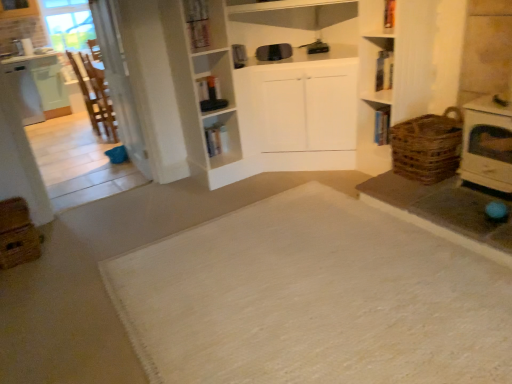
Identify the location of white woven mat at center. (313, 299).

The image size is (512, 384). I want to click on brown woven crate at lower left, so click(17, 234).

I want to click on white woven mat at center, so (x=313, y=299).

Is brown woven crate at lower left surrounded by white woven mat at center?

No, brown woven crate at lower left is not inside white woven mat at center.

Locate an element on the screen. crate located above the white woven mat at center (from the image's perspective) is located at coordinates (17, 234).

From a real-world perspective, is white woven mat at center below brown woven crate at lower left?

Correct, in the physical world, white woven mat at center is lower than brown woven crate at lower left.

Between white woven mat at center and brown woven crate at lower left, which one has less height?

white woven mat at center is shorter.

Considering the sizes of objects white woven mat at center and brown woven basket at right in the image provided, who is thinner, white woven mat at center or brown woven basket at right?

brown woven basket at right is thinner.

Which point is more distant from viewer, [112,281] or [414,176]?

The point [414,176] is farther.

Is white woven mat at center taller or shorter than brown woven basket at right?

Clearly, white woven mat at center is shorter compared to brown woven basket at right.

Image resolution: width=512 pixels, height=384 pixels. Find the location of `basket behind the white woven mat at center`. basket behind the white woven mat at center is located at coordinates [426, 146].

Considering the sizes of objects brown woven basket at right and wooden chair at left in the image provided, who is shorter, brown woven basket at right or wooden chair at left?

With less height is brown woven basket at right.

Is point (431, 167) in front of point (82, 77)?

Yes, point (431, 167) is closer to viewer.

Is brown woven basket at right aimed at wooden chair at left?

No, brown woven basket at right is not oriented towards wooden chair at left.

From the image's perspective, between brown woven basket at right and wooden chair at left, who is located below?

brown woven basket at right appears lower in the image.

From the image's perspective, which one is positioned higher, wooden chair at left or white woven mat at center?

wooden chair at left, from the image's perspective.

Based on the photo, from a real-world perspective, which object stands above the other?

wooden chair at left.

Which of these two, wooden chair at left or white woven mat at center, stands taller?

wooden chair at left is taller.

Between wooden chair at left and white woven mat at center, which one is positioned in front?

white woven mat at center is closer to the camera.

Does point (434, 158) come closer to viewer compared to point (15, 236)?

No, it is not.

How many degrees apart are the facing directions of brown woven basket at right and brown woven crate at lower left?

The facing directions of brown woven basket at right and brown woven crate at lower left are 178 degrees apart.

Image resolution: width=512 pixels, height=384 pixels. What are the coordinates of `crate lying below the brown woven basket at right (from the image's perspective)` in the screenshot? It's located at (17, 234).

From the image's perspective, is brown woven basket at right above or below brown woven crate at lower left?

Based on their image positions, brown woven basket at right is located above brown woven crate at lower left.

Does brown woven crate at lower left have a larger size compared to brown woven basket at right?

No, brown woven crate at lower left is not bigger than brown woven basket at right.

From the image's perspective, between brown woven crate at lower left and brown woven basket at right, who is located below?

From the image's view, brown woven crate at lower left is below.

Does brown woven crate at lower left have a lesser height compared to brown woven basket at right?

Indeed, brown woven crate at lower left has a lesser height compared to brown woven basket at right.

From a real-world perspective, who is located lower, brown woven crate at lower left or brown woven basket at right?

brown woven crate at lower left is physically lower.

From the picture: From a real-world perspective, which object stands above the other?

brown woven basket at right, from a real-world perspective.

Looking at this image, in terms of height, does brown woven basket at right look taller or shorter compared to white woven mat at center?

brown woven basket at right is taller than white woven mat at center.

Locate an element on the screen. The image size is (512, 384). basket behind the white woven mat at center is located at coordinates 426,146.

Which point is more distant from viewer, [435,115] or [341,275]?

The point [435,115] is behind.

This screenshot has height=384, width=512. In order to click on doormat that appears on the right of brown woven crate at lower left in this screenshot , I will do `click(313, 299)`.

The width and height of the screenshot is (512, 384). Identify the location of doormat below the brown woven basket at right (from a real-world perspective). (313, 299).

Estimate the real-world distances between objects in this image. Which object is closer to brown woven basket at right, white woven mat at center or brown woven crate at lower left?

Among the two, white woven mat at center is located nearer to brown woven basket at right.

Which object lies further to the anchor point wooden chair at left, brown woven basket at right or brown woven crate at lower left?

brown woven basket at right.

Looking at the image, which one is located further to white woven mat at center, wooden chair at left or brown woven basket at right?

Among the two, wooden chair at left is located further to white woven mat at center.

From the image, which object appears to be farther from brown woven crate at lower left, wooden chair at left or brown woven basket at right?

Among the two, brown woven basket at right is located further to brown woven crate at lower left.

Consider the image. From the image, which object appears to be nearer to wooden chair at left, brown woven crate at lower left or white woven mat at center?

brown woven crate at lower left is positioned closer to the anchor wooden chair at left.

When comparing their distances from brown woven crate at lower left, does white woven mat at center or brown woven basket at right seem further?

Among the two, brown woven basket at right is located further to brown woven crate at lower left.

From the image, which object appears to be nearer to wooden chair at left, white woven mat at center or brown woven crate at lower left?

brown woven crate at lower left is closer to wooden chair at left.

When comparing their distances from brown woven crate at lower left, does white woven mat at center or wooden chair at left seem further?

Among the two, wooden chair at left is located further to brown woven crate at lower left.

Identify the location of crate between wooden chair at left and brown woven basket at right in the horizontal direction. This screenshot has height=384, width=512. (17, 234).

You are a GUI agent. You are given a task and a screenshot of the screen. Output one action in this format:
    pyautogui.click(x=<x>, y=<y>)
    Task: Click on the doormat between brown woven crate at lower left and brown woven basket at right
    
    Given the screenshot: What is the action you would take?
    pyautogui.click(x=313, y=299)

Where is `crate between white woven mat at center and wooden chair at left from front to back`? Image resolution: width=512 pixels, height=384 pixels. crate between white woven mat at center and wooden chair at left from front to back is located at coordinates (17, 234).

Where is `basket between white woven mat at center and wooden chair at left along the z-axis`? The height and width of the screenshot is (384, 512). basket between white woven mat at center and wooden chair at left along the z-axis is located at coordinates (426, 146).